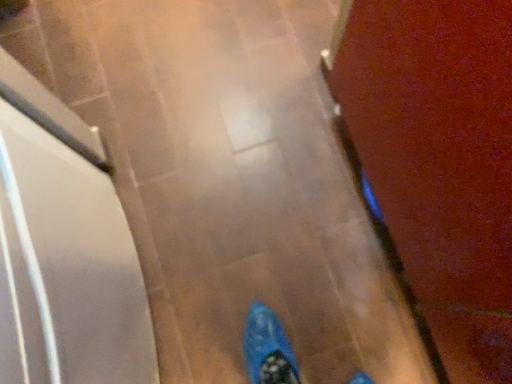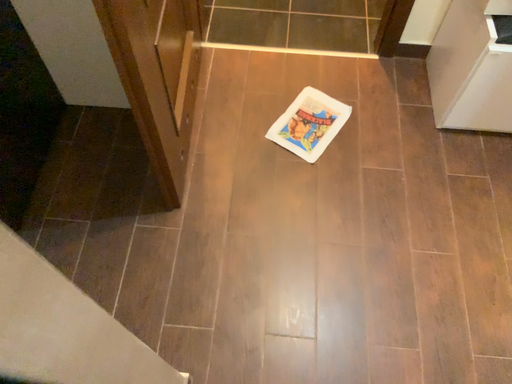
Question: How did the camera likely rotate when shooting the video?

Choices:
 (A) rotated upward
 (B) rotated downward

Answer: (A)